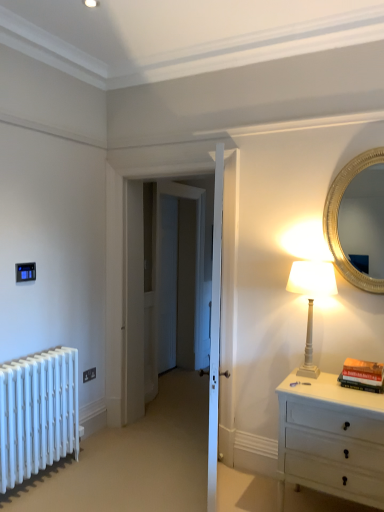
In order to click on hardcover book at right in this screenshot , I will do `click(362, 375)`.

Measure the distance between point (377, 189) and camera.

Point (377, 189) is 3.05 meters from camera.

Image resolution: width=384 pixels, height=512 pixels. Describe the element at coordinates (89, 374) in the screenshot. I see `black plastic electrical outlet at lower left` at that location.

This screenshot has width=384, height=512. Describe the element at coordinates (311, 300) in the screenshot. I see `white glossy table lamp at right` at that location.

Identify the location of hardcover book at right. coord(362,375).

Is point (1, 423) positioned before point (368, 382)?

No.

Based on the photo, is hardcover book at right a part of white metallic radiator at lower left?

No, hardcover book at right is not inside white metallic radiator at lower left.

Considering the sizes of white metallic radiator at lower left and hardcover book at right in the image, is white metallic radiator at lower left bigger or smaller than hardcover book at right?

white metallic radiator at lower left is bigger than hardcover book at right.

From the image's perspective, between white metallic radiator at lower left and white painted wood chest of drawers at right, who is located below?

white painted wood chest of drawers at right, from the image's perspective.

Can you confirm if white metallic radiator at lower left is bigger than white painted wood chest of drawers at right?

No, white metallic radiator at lower left is not bigger than white painted wood chest of drawers at right.

Is white metallic radiator at lower left wider than white painted wood chest of drawers at right?

In fact, white metallic radiator at lower left might be narrower than white painted wood chest of drawers at right.

Considering the sizes of objects white metallic radiator at lower left and black plastic electrical outlet at lower left in the image provided, who is bigger, white metallic radiator at lower left or black plastic electrical outlet at lower left?

With larger size is white metallic radiator at lower left.

How much distance is there between white metallic radiator at lower left and black plastic electrical outlet at lower left?

white metallic radiator at lower left and black plastic electrical outlet at lower left are 29.47 inches apart.

Where is `electric outlet located above the white metallic radiator at lower left (from the image's perspective)`? The width and height of the screenshot is (384, 512). electric outlet located above the white metallic radiator at lower left (from the image's perspective) is located at coordinates (89, 374).

From a real-world perspective, does white metallic radiator at lower left stand above black plastic electrical outlet at lower left?

No.

Consider the image. From a real-world perspective, which is physically above, white glossy table lamp at right or black plastic electrical outlet at lower left?

In real-world perspective, white glossy table lamp at right is above.

Is the position of white glossy table lamp at right more distant than that of black plastic electrical outlet at lower left?

No, it is not.

Could you tell me if white glossy table lamp at right is turned towards black plastic electrical outlet at lower left?

No, white glossy table lamp at right does not turn towards black plastic electrical outlet at lower left.

Which is more to the right, white glossy table lamp at right or black plastic electrical outlet at lower left?

Positioned to the right is white glossy table lamp at right.

Between white metallic radiator at lower left and white glossy table lamp at right, which one appears on the left side from the viewer's perspective?

Positioned to the left is white metallic radiator at lower left.

Is white metallic radiator at lower left oriented away from white glossy table lamp at right?

No, white metallic radiator at lower left's orientation is not away from white glossy table lamp at right.

How much distance is there between white metallic radiator at lower left and white glossy table lamp at right?

white metallic radiator at lower left and white glossy table lamp at right are 1.68 meters apart.

From a real-world perspective, which object stands above the other?

In real-world perspective, white glossy table lamp at right is above.

Is hardcover book at right at the back of white glossy table lamp at right?

white glossy table lamp at right is not turned away from hardcover book at right.

Is white glossy table lamp at right inside the boundaries of hardcover book at right, or outside?

The correct answer is: outside.

At what (x,y) coordinates should I click in order to perform the action: click on table lamp behind the hardcover book at right. Please return your answer as a coordinate pair (x, y). Looking at the image, I should click on point(311,300).

From the image's perspective, which one is positioned lower, white glossy table lamp at right or hardcover book at right?

hardcover book at right appears lower in the image.

Based on the photo, is there a large distance between hardcover book at right and gold metallic mirror at upper right?

hardcover book at right is actually quite close to gold metallic mirror at upper right.

Can you confirm if hardcover book at right is smaller than gold metallic mirror at upper right?

Yes, hardcover book at right is smaller than gold metallic mirror at upper right.

Can you confirm if hardcover book at right is shorter than gold metallic mirror at upper right?

Yes, hardcover book at right is shorter than gold metallic mirror at upper right.

Consider the image. Would you say hardcover book at right is to the left or to the right of gold metallic mirror at upper right in the picture?

hardcover book at right is positioned on gold metallic mirror at upper right's right side.

The height and width of the screenshot is (512, 384). I want to click on radiator directly beneath the hardcover book at right (from a real-world perspective), so click(x=37, y=413).

Identify the location of the chest of drawers below the white metallic radiator at lower left (from the image's perspective). (331, 439).

When comparing their distances from white painted wood chest of drawers at right, does gold metallic mirror at upper right or white glossy table lamp at right seem further?

The object further to white painted wood chest of drawers at right is gold metallic mirror at upper right.

When comparing their distances from gold metallic mirror at upper right, does white glossy table lamp at right or hardcover book at right seem closer?

The object closer to gold metallic mirror at upper right is white glossy table lamp at right.

Looking at the image, which one is located closer to hardcover book at right, white metallic radiator at lower left or black plastic electrical outlet at lower left?

white metallic radiator at lower left is positioned closer to the anchor hardcover book at right.

Considering their positions, is black plastic electrical outlet at lower left positioned closer to gold metallic mirror at upper right than hardcover book at right?

hardcover book at right is positioned closer to the anchor gold metallic mirror at upper right.

From the picture: Considering their positions, is hardcover book at right positioned further to white painted wood chest of drawers at right than black plastic electrical outlet at lower left?

black plastic electrical outlet at lower left is further to white painted wood chest of drawers at right.

Estimate the real-world distances between objects in this image. Which object is closer to black plastic electrical outlet at lower left, gold metallic mirror at upper right or white glossy table lamp at right?

white glossy table lamp at right lies closer to black plastic electrical outlet at lower left than the other object.

Based on their spatial positions, is white painted wood chest of drawers at right or white glossy table lamp at right further from gold metallic mirror at upper right?

white painted wood chest of drawers at right.

Based on their spatial positions, is gold metallic mirror at upper right or white painted wood chest of drawers at right closer to white metallic radiator at lower left?

white painted wood chest of drawers at right is positioned closer to the anchor white metallic radiator at lower left.

Locate an element on the screen. the chest of drawers situated between white metallic radiator at lower left and gold metallic mirror at upper right from left to right is located at coordinates pos(331,439).

Where is `chest of drawers between black plastic electrical outlet at lower left and gold metallic mirror at upper right`? chest of drawers between black plastic electrical outlet at lower left and gold metallic mirror at upper right is located at coordinates (331, 439).

Where is `table lamp between gold metallic mirror at upper right and hardcover book at right in the vertical direction`? The height and width of the screenshot is (512, 384). table lamp between gold metallic mirror at upper right and hardcover book at right in the vertical direction is located at coordinates (311, 300).

This screenshot has width=384, height=512. Identify the location of mirror situated between white metallic radiator at lower left and hardcover book at right from left to right. (364, 221).